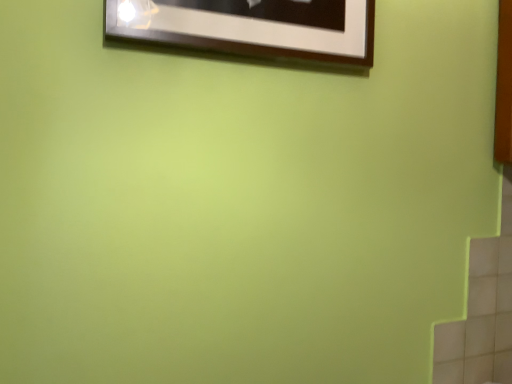
What do you see at coordinates (253, 27) in the screenshot? I see `brown wooden picture frame at upper center` at bounding box center [253, 27].

What is the approximate width of brown wooden picture frame at upper center?

It is 2.07 inches.

I want to click on brown wooden picture frame at upper center, so click(253, 27).

Locate an element on the screen. The height and width of the screenshot is (384, 512). brown wooden picture frame at upper center is located at coordinates [x=253, y=27].